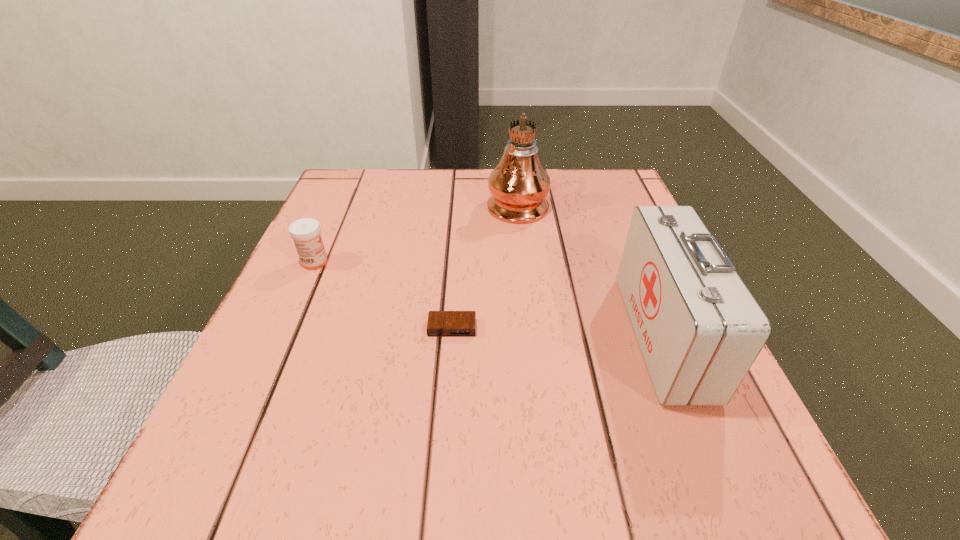
The width and height of the screenshot is (960, 540). What are the coordinates of `the farthest object` in the screenshot? It's located at (x=519, y=184).

I want to click on oil lamp, so click(x=519, y=184).

What are the coordinates of `the first-aid kit` in the screenshot? It's located at [x=699, y=328].

This screenshot has width=960, height=540. Identify the location of the rightmost object. tap(699, 328).

Image resolution: width=960 pixels, height=540 pixels. Find the location of `medicine`. medicine is located at coordinates (305, 232).

I want to click on the third tallest object, so click(305, 232).

Where is `the second object from left to right`? This screenshot has height=540, width=960. the second object from left to right is located at coordinates (440, 323).

The image size is (960, 540). I want to click on alarm clock, so click(x=440, y=323).

Find the location of `free space located 0.200m on the left of the farthest object`. free space located 0.200m on the left of the farthest object is located at coordinates (404, 202).

Image resolution: width=960 pixels, height=540 pixels. I want to click on vacant area located on the front-facing side of the rightmost object, so click(x=582, y=335).